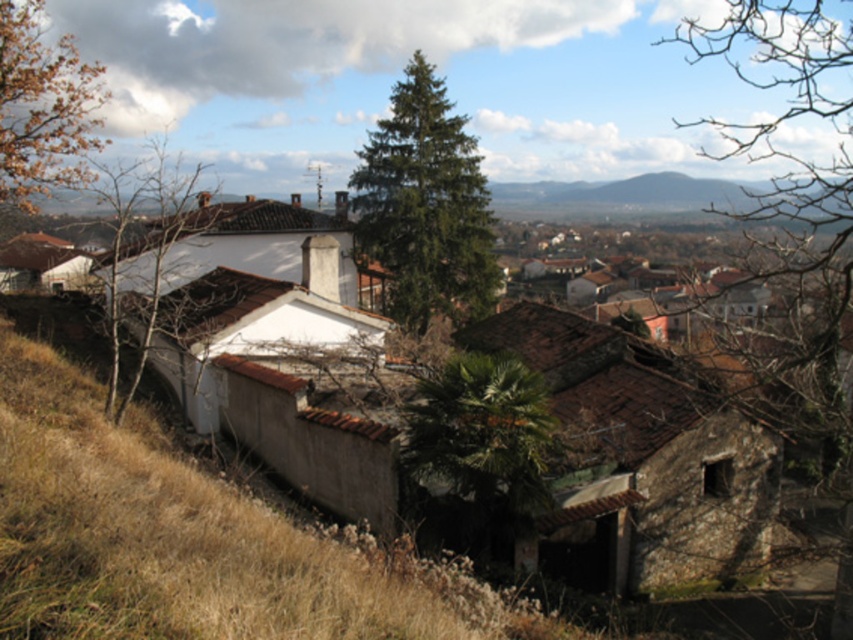
Does brown clay wall at lower left have a lesser height compared to bare branches at right?

Yes.

Locate an element on the screen. The image size is (853, 640). brown clay wall at lower left is located at coordinates (184, 538).

Is point (10, 614) positioned before point (747, 36)?

Yes.

Identify the location of brown clay wall at lower left. (184, 538).

Consider the image. Is brown clay wall at lower left further to the viewer compared to brown leafy tree at left?

No.

Can you confirm if brown clay wall at lower left is positioned above brown leafy tree at left?

No.

What do you see at coordinates (184, 538) in the screenshot? I see `brown clay wall at lower left` at bounding box center [184, 538].

Image resolution: width=853 pixels, height=640 pixels. I want to click on brown clay wall at lower left, so click(x=184, y=538).

Does point (445, 156) come in front of point (473, 554)?

No, it is not.

Is green needle-like tree at center above green leafy palm at center?

Yes.

Where is `green needle-like tree at center`? The image size is (853, 640). green needle-like tree at center is located at coordinates (425, 205).

Locate an element on the screen. This screenshot has width=853, height=640. green needle-like tree at center is located at coordinates (425, 205).